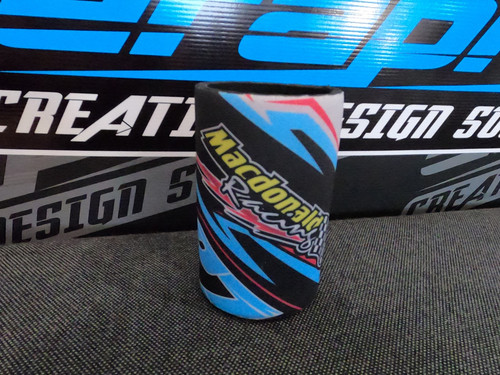
The height and width of the screenshot is (375, 500). In order to click on surface coozy is sitting on in this screenshot , I will do `click(260, 355)`.